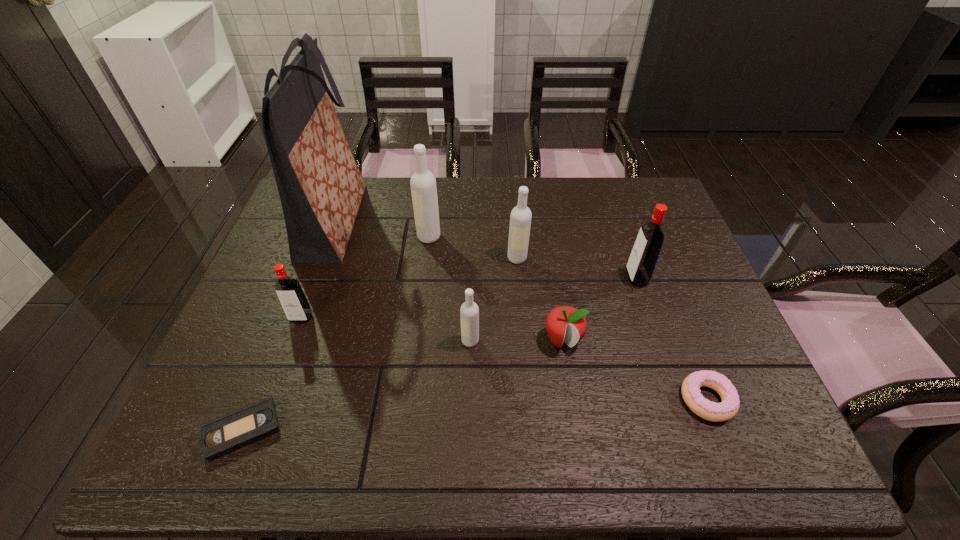
You are a GUI agent. You are given a task and a screenshot of the screen. Output one action in this format:
    pyautogui.click(x=<x>, y=<y>)
    Task: Click on the vacant space at the left edge
    The height and width of the screenshot is (540, 960).
    Given the screenshot: What is the action you would take?
    pyautogui.click(x=248, y=393)

Identify the location of free space at the right edge of the desktop. Image resolution: width=960 pixels, height=540 pixels. (690, 327).

Image resolution: width=960 pixels, height=540 pixels. In the image, there is a desktop. In order to click on vacant space at the far right corner in this screenshot , I will do `click(634, 178)`.

Image resolution: width=960 pixels, height=540 pixels. Find the location of `free space between the third nearest vodka and the tallest object`. free space between the third nearest vodka and the tallest object is located at coordinates 486,249.

At what (x,y) coordinates should I click in order to perform the action: click on vacant region between the seventh tallest object and the videotape. Please return your answer as a coordinate pair (x, y). This screenshot has height=540, width=960. Looking at the image, I should click on (402, 385).

Where is `vacant space that's between the second vodka from right to left and the nearest vodka`? This screenshot has width=960, height=540. vacant space that's between the second vodka from right to left and the nearest vodka is located at coordinates (493, 300).

Locate an element on the screen. vacant area that lies between the red apple and the shortest object is located at coordinates (402, 385).

Where is `blank region between the apple and the videotape`? The height and width of the screenshot is (540, 960). blank region between the apple and the videotape is located at coordinates (402, 385).

Where is `free area in between the apple and the shortest object`? This screenshot has height=540, width=960. free area in between the apple and the shortest object is located at coordinates (402, 385).

Find the location of a particular element. This screenshot has width=960, height=540. empty location between the videotape and the eighth shortest object is located at coordinates (336, 333).